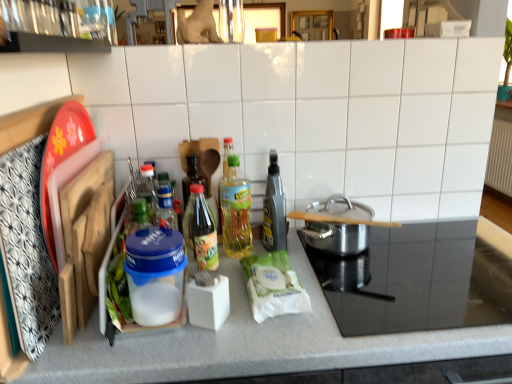
Question: Should I look upward or downward to see translucent plastic bottle at center, the 2th bottle from the left?

Choices:
 (A) down
 (B) up

Answer: (A)

Question: In which direction should I rotate to look at green glass bottle at center, which is counted as the first bottle, starting from the left?

Choices:
 (A) left
 (B) right

Answer: (A)

Question: Is metallic gray spray bottle at center, which is the 3th bottle in left-to-right order, positioned with its back to blue plastic container at center-left, the second appliance when ordered from right to left?

Choices:
 (A) yes
 (B) no

Answer: (B)

Question: Considering the relative sizes of metallic gray spray bottle at center, positioned as the 1th bottle in right-to-left order, and blue plastic container at center-left, positioned as the first appliance in left-to-right order, in the image provided, is metallic gray spray bottle at center, positioned as the 1th bottle in right-to-left order, wider than blue plastic container at center-left, positioned as the first appliance in left-to-right order,?

Choices:
 (A) yes
 (B) no

Answer: (A)

Question: Considering the relative positions of metallic gray spray bottle at center, positioned as the 1th bottle in right-to-left order, and blue plastic container at center-left, positioned as the first appliance in left-to-right order, in the image provided, is metallic gray spray bottle at center, positioned as the 1th bottle in right-to-left order, to the left of blue plastic container at center-left, positioned as the first appliance in left-to-right order, from the viewer's perspective?

Choices:
 (A) no
 (B) yes

Answer: (A)

Question: Does metallic gray spray bottle at center, which is the 3th bottle in left-to-right order, have a larger size compared to blue plastic container at center-left, positioned as the first appliance in left-to-right order?

Choices:
 (A) yes
 (B) no

Answer: (A)

Question: Is metallic gray spray bottle at center, positioned as the 1th bottle in right-to-left order, far away from blue plastic container at center-left, the second appliance when ordered from right to left?

Choices:
 (A) yes
 (B) no

Answer: (B)

Question: Is metallic gray spray bottle at center, which is the 3th bottle in left-to-right order, beside blue plastic container at center-left, the second appliance when ordered from right to left?

Choices:
 (A) no
 (B) yes

Answer: (A)

Question: Does green glass bottle at center, the 3th bottle viewed from the right, appear on the right side of blue plastic container at center-left, the second appliance when ordered from right to left?

Choices:
 (A) no
 (B) yes

Answer: (B)

Question: From the image's perspective, is green glass bottle at center, the 3th bottle viewed from the right, beneath blue plastic container at center-left, the second appliance when ordered from right to left?

Choices:
 (A) yes
 (B) no

Answer: (B)

Question: Does green glass bottle at center, which is counted as the first bottle, starting from the left, turn towards blue plastic container at center-left, positioned as the first appliance in left-to-right order?

Choices:
 (A) no
 (B) yes

Answer: (A)

Question: Is green glass bottle at center, the 3th bottle viewed from the right, not within blue plastic container at center-left, the second appliance when ordered from right to left?

Choices:
 (A) no
 (B) yes

Answer: (B)

Question: Is blue plastic container at center-left, positioned as the first appliance in left-to-right order, completely or partially inside green glass bottle at center, which is counted as the first bottle, starting from the left?

Choices:
 (A) yes
 (B) no

Answer: (B)

Question: Is the depth of green glass bottle at center, the 3th bottle viewed from the right, greater than that of blue plastic container at center-left, the second appliance when ordered from right to left?

Choices:
 (A) yes
 (B) no

Answer: (A)

Question: Does white matte countertop at center have a greater height compared to polished stainless steel pot at center right?

Choices:
 (A) no
 (B) yes

Answer: (B)